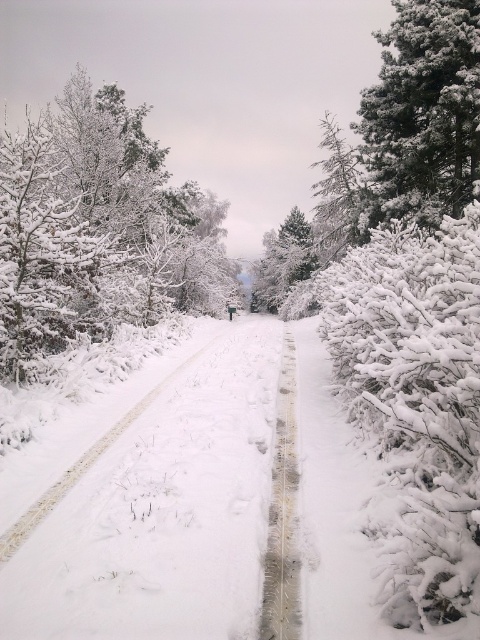
You are an observer standing on the snow path. You see a white frosty tree at left and a green textured pine at center. Which tree is higher in the image?

The white frosty tree at left is above the green textured pine at center, so it is higher in the image.